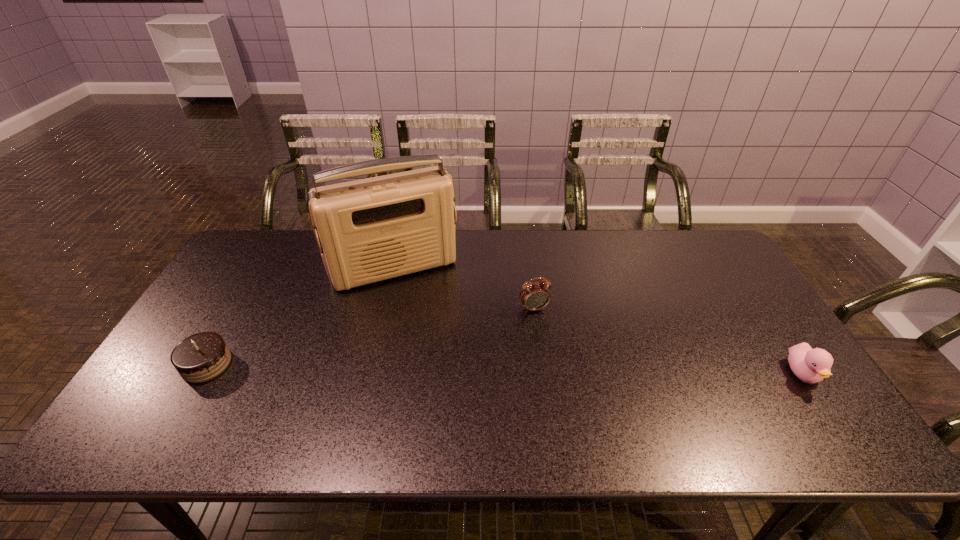
At what (x,y) coordinates should I click in order to perform the action: click on free area in between the second farthest object and the radio receiver. Please return your answer as a coordinate pair (x, y). This screenshot has width=960, height=540. Looking at the image, I should click on (465, 288).

You are a GUI agent. You are given a task and a screenshot of the screen. Output one action in this format:
    pyautogui.click(x=<x>, y=<y>)
    Task: Click on the vacant area that lies between the second object from right to left and the leftmost object
    Image resolution: width=960 pixels, height=540 pixels.
    Given the screenshot: What is the action you would take?
    pyautogui.click(x=370, y=336)

The height and width of the screenshot is (540, 960). What are the coordinates of `vacant region between the alarm clock and the radio receiver` in the screenshot? It's located at (465, 288).

Find the location of `empty space between the chocolate cake and the duckling`. empty space between the chocolate cake and the duckling is located at coordinates (505, 369).

Find the location of a particular element. The height and width of the screenshot is (540, 960). free area in between the second object from right to left and the duckling is located at coordinates (668, 341).

The width and height of the screenshot is (960, 540). I want to click on empty space between the third nearest object and the duckling, so tap(668, 341).

This screenshot has height=540, width=960. Find the location of `unoccupied position between the rightmost object and the third nearest object`. unoccupied position between the rightmost object and the third nearest object is located at coordinates (668, 341).

Point out which object is positioned as the third nearest to the leftmost object. Please provide its 2D coordinates. Your answer should be formatted as a tuple, i.e. [(x, y)], where the tuple contains the x and y coordinates of a point satisfying the conditions above.

[(810, 365)]

Locate which object ranks second in proximity to the rightmost object. Please provide its 2D coordinates. Your answer should be formatted as a tuple, i.e. [(x, y)], where the tuple contains the x and y coordinates of a point satisfying the conditions above.

[(369, 230)]